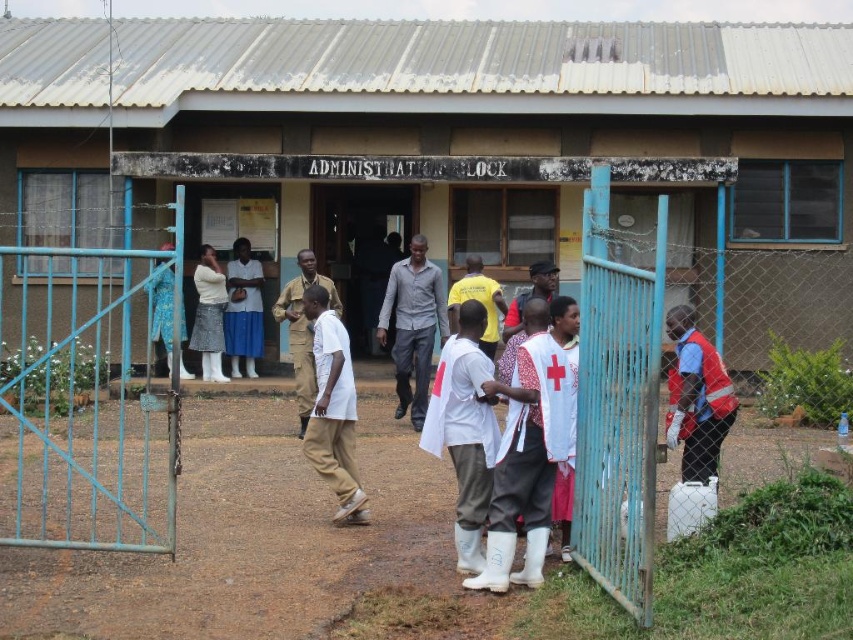
You are a delivery person trying to enter the ADMINISTRATION BLOCK. You see the brown corrugated metal hut at center and the blue metal gate at right. Which object should you approach first to gain entry?

The blue metal gate at right is the entrance, so you should approach the blue metal gate at right first to gain entry.

You are a security guard at the ADMINISTRATION BLOCK. You notice two people in the crowd outside the building. One is wearing a reflective orange vest at right, and the other is wearing a gray matte shirt at center. Which of these two individuals is standing more to your right side?

The reflective orange vest at right is positioned on the right side of gray matte shirt at center, so the reflective orange vest at right is standing more to your right side.

You are standing in front of the ADMINISTRATION BLOCK building and want to locate two specific points marked on the ground. The first point is at coordinates point (698, 340) and the second at point (398, 352). Which of these two points is closer to you?

Point (698, 340) is closer to the viewer than point (398, 352), so the first point is closer to you.